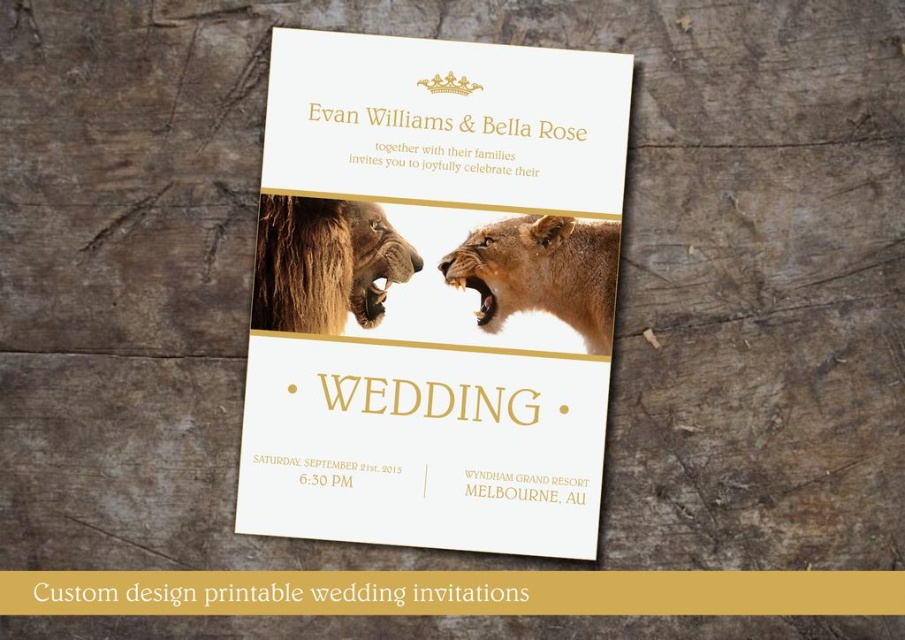
Who is taller, golden textured lion at center or golden fur lion at center?

Standing taller between the two is golden textured lion at center.

Image resolution: width=905 pixels, height=640 pixels. What are the coordinates of `golden textured lion at center` in the screenshot? It's located at (324, 262).

Is point (599, 157) positioned after point (448, 84)?

No, (599, 157) is closer to viewer.

In the scene shown: Does gold paper invitation at upper center have a larger size compared to gold metallic crown at upper center?

Yes.

Locate an element on the screen. Image resolution: width=905 pixels, height=640 pixels. gold paper invitation at upper center is located at coordinates (446, 122).

Who is lower down, golden textured lion at center or gold metallic crown at upper center?

golden textured lion at center is below.

Locate an element on the screen. The width and height of the screenshot is (905, 640). golden textured lion at center is located at coordinates (324, 262).

Identify the location of golden textured lion at center. (324, 262).